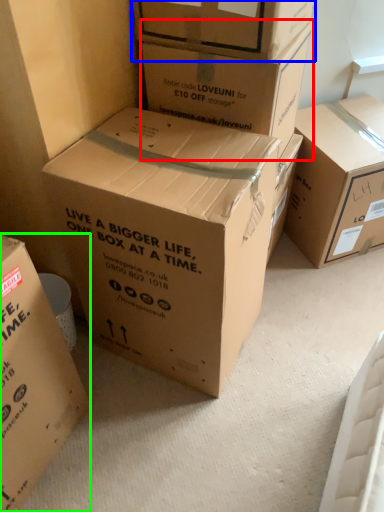
Question: Considering the real-world distances, which object is closest to box (highlighted by a red box)? box (highlighted by a blue box) or box (highlighted by a green box).

Choices:
 (A) box
 (B) box

Answer: (A)